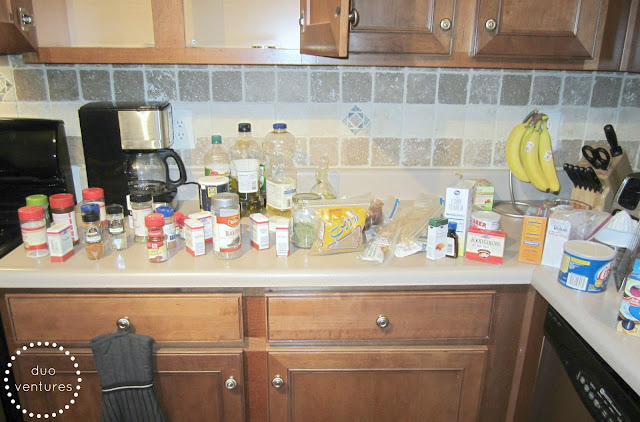
Identify the location of cabinet doors. (305, 312), (182, 320), (196, 370), (395, 397), (344, 23), (404, 39), (531, 45).